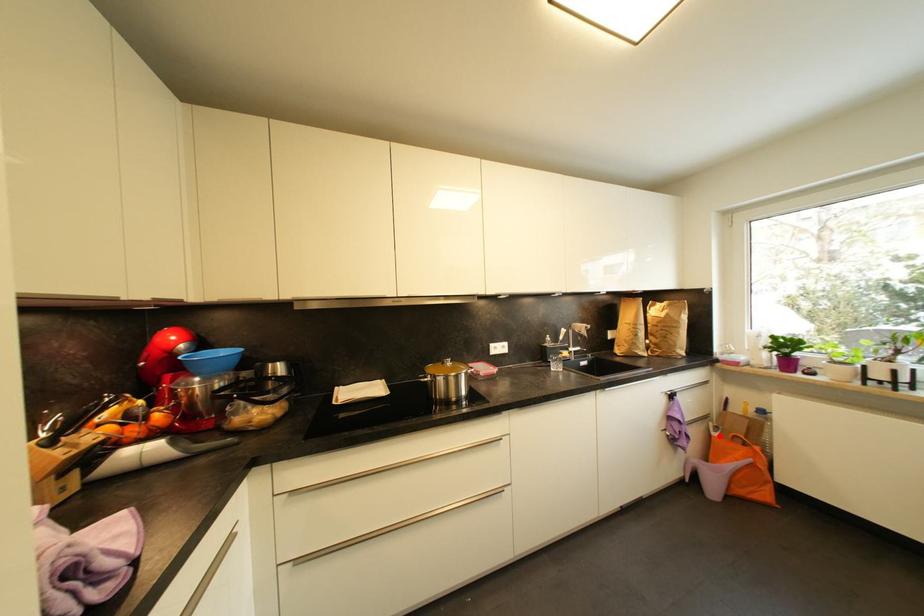
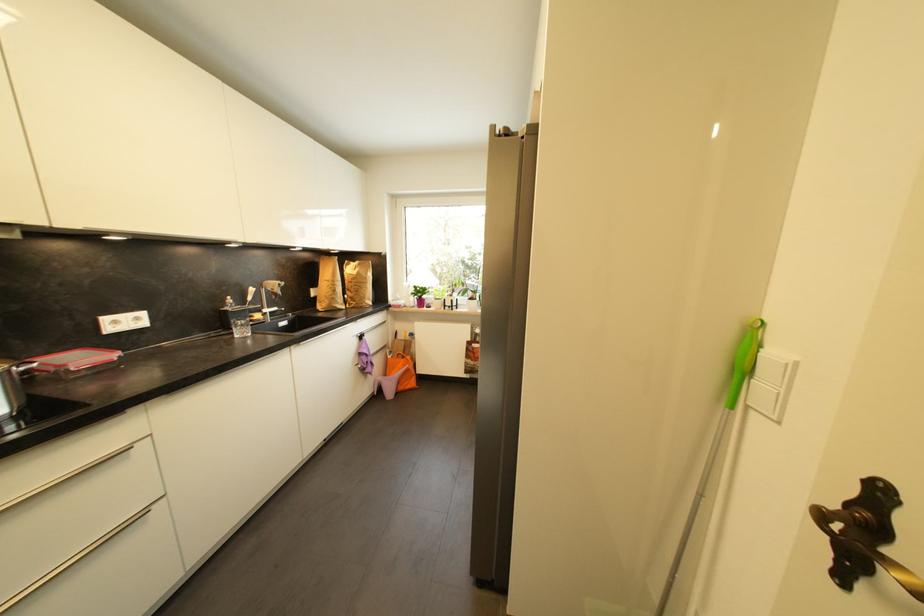
Question: I am providing you with two images of the same scene from different viewpoints. A red point is shown in image1. For the corresponding object point in image2, is it positioned nearer or farther from the camera?

Choices:
 (A) Nearer
 (B) Farther

Answer: (B)